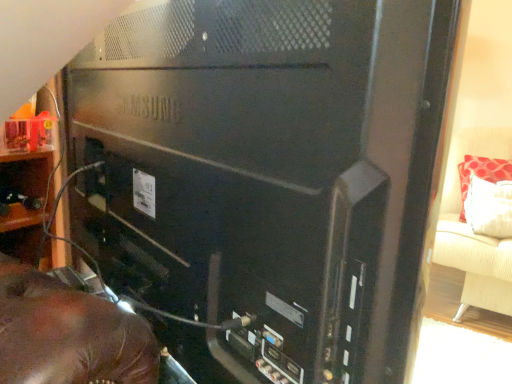
Question: From a real-world perspective, does beige fabric couch at right sit lower than black matte computer tower at center?

Choices:
 (A) no
 (B) yes

Answer: (B)

Question: Is beige fabric couch at right further to camera compared to black matte computer tower at center?

Choices:
 (A) yes
 (B) no

Answer: (A)

Question: Considering the relative sizes of beige fabric couch at right and black matte computer tower at center in the image provided, is beige fabric couch at right thinner than black matte computer tower at center?

Choices:
 (A) yes
 (B) no

Answer: (B)

Question: Is beige fabric couch at right positioned far away from black matte computer tower at center?

Choices:
 (A) yes
 (B) no

Answer: (A)

Question: Considering the relative sizes of beige fabric couch at right and black matte computer tower at center in the image provided, is beige fabric couch at right wider than black matte computer tower at center?

Choices:
 (A) no
 (B) yes

Answer: (B)

Question: Considering the positions of black matte computer tower at center and wooden shelf at left in the image, is black matte computer tower at center taller or shorter than wooden shelf at left?

Choices:
 (A) short
 (B) tall

Answer: (B)

Question: Is black matte computer tower at center bigger or smaller than wooden shelf at left?

Choices:
 (A) big
 (B) small

Answer: (A)

Question: In the image, is black matte computer tower at center positioned in front of or behind wooden shelf at left?

Choices:
 (A) behind
 (B) front

Answer: (B)

Question: From a real-world perspective, relative to wooden shelf at left, is black matte computer tower at center vertically above or below?

Choices:
 (A) above
 (B) below

Answer: (A)

Question: Choose the correct answer: Is wooden shelf at left inside red fabric pillow at right or outside it?

Choices:
 (A) outside
 (B) inside

Answer: (A)

Question: Is wooden shelf at left in front of or behind red fabric pillow at right in the image?

Choices:
 (A) front
 (B) behind

Answer: (A)

Question: From a real-world perspective, is wooden shelf at left positioned above or below red fabric pillow at right?

Choices:
 (A) above
 (B) below

Answer: (A)

Question: Considering the positions of wooden shelf at left and red fabric pillow at right in the image, is wooden shelf at left bigger or smaller than red fabric pillow at right?

Choices:
 (A) small
 (B) big

Answer: (A)

Question: Is point (3, 218) positioned closer to the camera than point (229, 372)?

Choices:
 (A) farther
 (B) closer

Answer: (A)

Question: From the image's perspective, is wooden shelf at left located above or below black matte computer tower at center?

Choices:
 (A) below
 (B) above

Answer: (A)